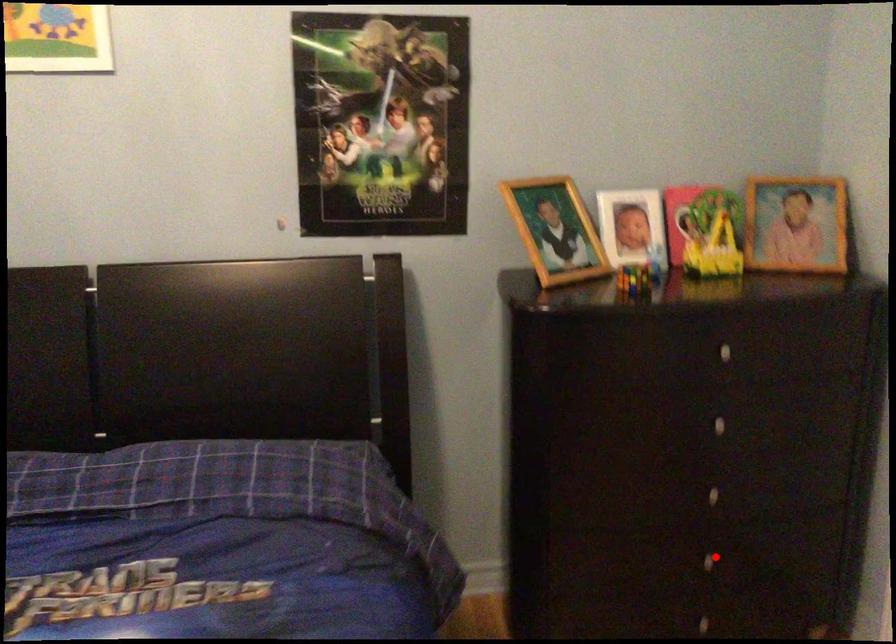
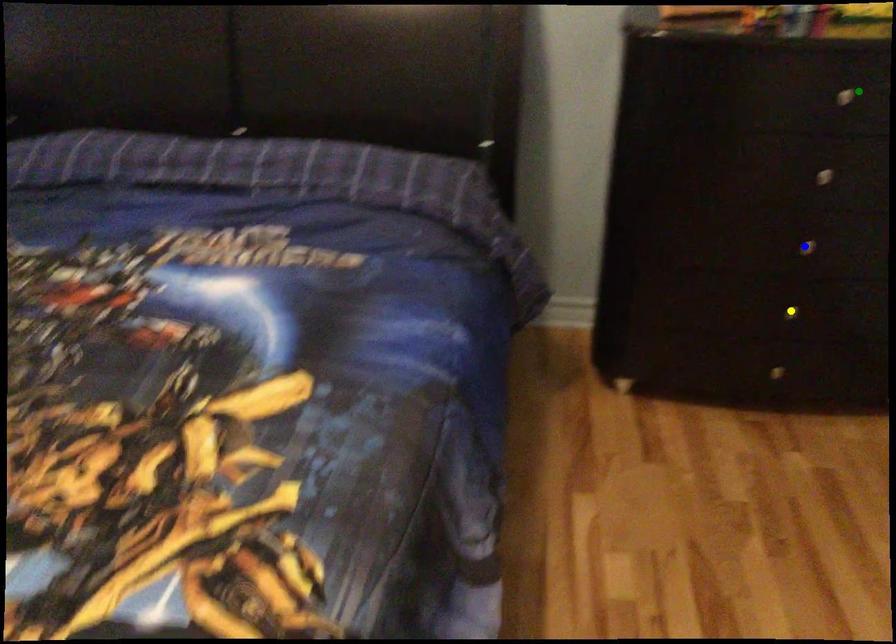
Question: I am providing you with two images of the same scene from different viewpoints. A red point is marked on the first image. You are given multiple points on the second image. Which point in image 2 is actually the same real-world point as the red point in image 1?

Choices:
 (A) green point
 (B) blue point
 (C) yellow point

Answer: (C)